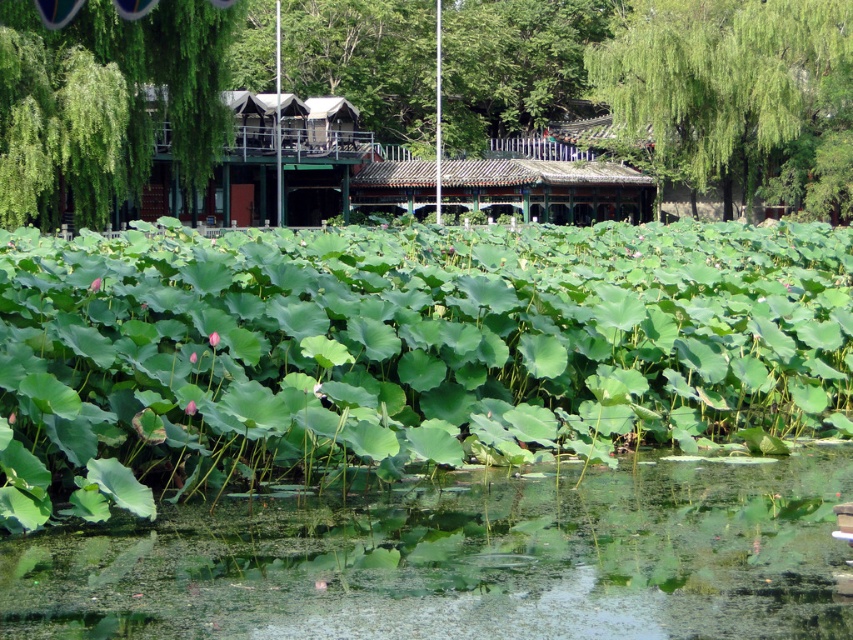
Based on the photo, does green leafy tree at upper right have a greater width compared to green leafy tree at upper left?

Yes, green leafy tree at upper right is wider than green leafy tree at upper left.

Does point (769, 179) come farther from viewer compared to point (33, 68)?

Yes.

Where is `green leafy tree at upper right`? Image resolution: width=853 pixels, height=640 pixels. green leafy tree at upper right is located at coordinates (735, 97).

Measure the distance between green leafy tree at upper left and brown tiled hut at center.

A distance of 85.96 feet exists between green leafy tree at upper left and brown tiled hut at center.

Which is behind, point (222, 24) or point (447, 172)?

The point (447, 172) is more distant.

This screenshot has width=853, height=640. What are the coordinates of `green leafy tree at upper left` in the screenshot? It's located at (103, 104).

Is green leafy tree at upper right to the left of brown tiled hut at center from the viewer's perspective?

Incorrect, green leafy tree at upper right is not on the left side of brown tiled hut at center.

Between green leafy tree at upper right and brown tiled hut at center, which one has less height?

brown tiled hut at center

Between point (793, 45) and point (532, 161), which one is positioned in front?

Point (793, 45) is in front.

Find the location of a particular element. This screenshot has height=640, width=853. green leafy tree at upper right is located at coordinates (735, 97).